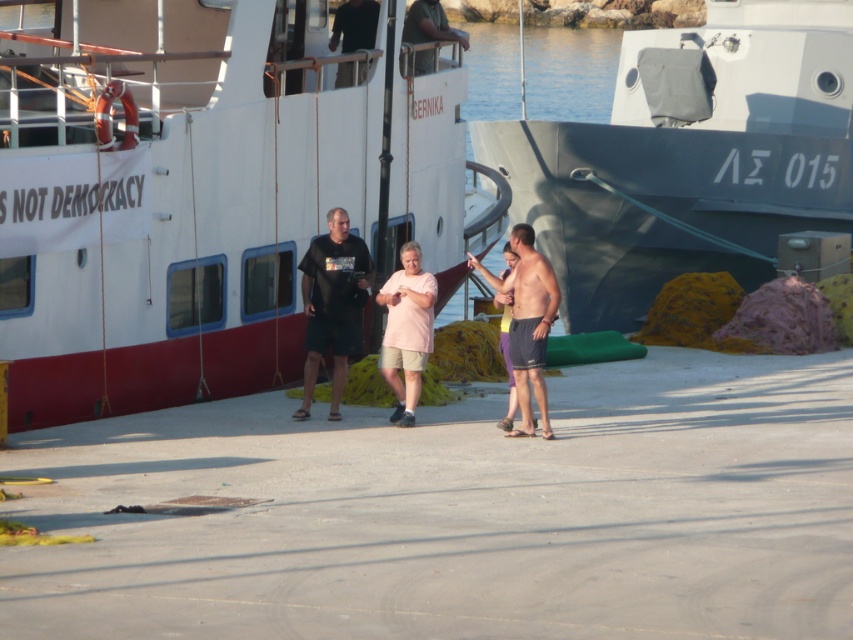
Does point (334, 316) come closer to viewer compared to point (415, 26)?

That is True.

Does black matte t-shirt at center have a greater height compared to dark green fabric shirt at upper center?

Indeed, black matte t-shirt at center has a greater height compared to dark green fabric shirt at upper center.

The image size is (853, 640). I want to click on black matte t-shirt at center, so click(x=331, y=304).

Is the position of white matte boat at center less distant than that of black matte shirt at upper center?

Yes, it is in front of black matte shirt at upper center.

Which is below, white matte boat at center or black matte shirt at upper center?

Positioned lower is black matte shirt at upper center.

Is point (119, 104) closer to viewer compared to point (341, 67)?

Yes, point (119, 104) is closer to viewer.

The width and height of the screenshot is (853, 640). I want to click on white matte boat at center, so click(x=201, y=193).

Does pink matte shorts at center have a greater height compared to dark green fabric shirt at upper center?

Indeed, pink matte shorts at center has a greater height compared to dark green fabric shirt at upper center.

Is pink matte shorts at center to the left of dark green fabric shirt at upper center from the viewer's perspective?

Correct, you'll find pink matte shorts at center to the left of dark green fabric shirt at upper center.

Which is in front, point (404, 387) or point (421, 32)?

Point (404, 387) is more forward.

The height and width of the screenshot is (640, 853). Identify the location of pink matte shorts at center. (405, 330).